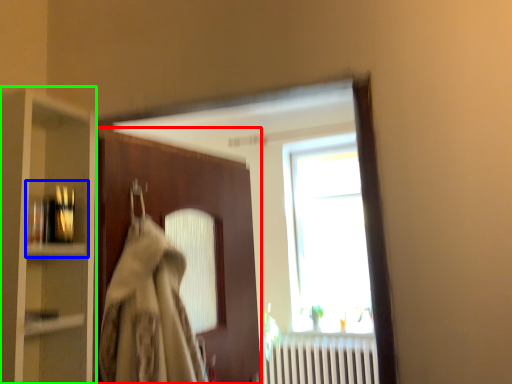
Question: Which is farther away from door (highlighted by a red box)? shelf (highlighted by a blue box) or cabinetry (highlighted by a green box)?

Choices:
 (A) shelf
 (B) cabinetry

Answer: (A)